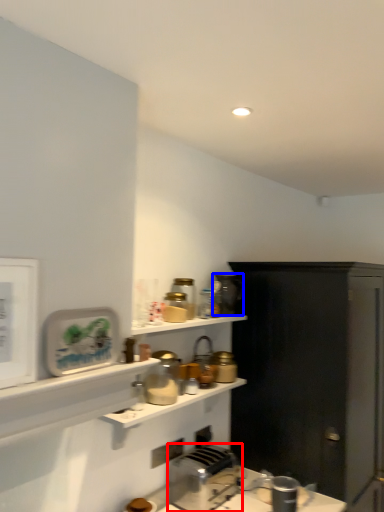
Question: Which point is further to the camera, toaster (highlighted by a red box) or appliance (highlighted by a blue box)?

Choices:
 (A) toaster
 (B) appliance

Answer: (B)